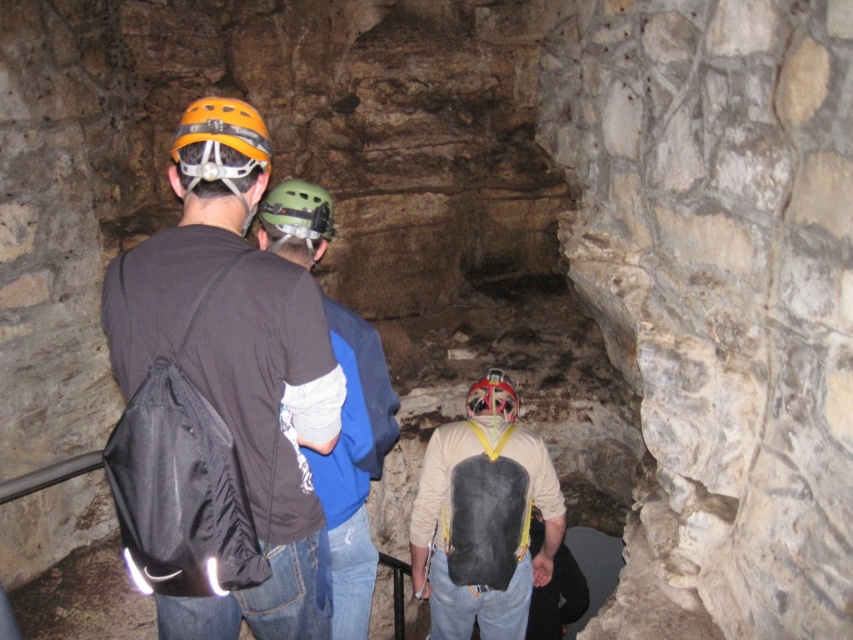
Question: Which point is farther to the camera?

Choices:
 (A) coord(212,154)
 (B) coord(461,632)
 (C) coord(137,467)

Answer: (B)

Question: Which point is closer to the camera?

Choices:
 (A) green matte helmet at center
 (B) orange matte helmet at upper left
 (C) matte black vest at center

Answer: (B)

Question: Is matte black backpack at left to the right of green matte helmet at center from the viewer's perspective?

Choices:
 (A) no
 (B) yes

Answer: (A)

Question: Which object is closer to the camera taking this photo?

Choices:
 (A) matte black vest at center
 (B) matte green helmet at center
 (C) orange matte helmet at upper left

Answer: (C)

Question: Is matte green helmet at center smaller than green matte helmet at center?

Choices:
 (A) yes
 (B) no

Answer: (B)

Question: Can you confirm if matte black backpack at left is positioned to the right of red matte helmet at center?

Choices:
 (A) no
 (B) yes

Answer: (A)